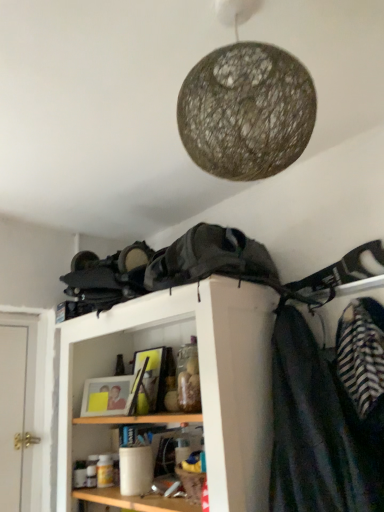
What do you see at coordinates (246, 105) in the screenshot?
I see `woven natural fiber lampshade at upper center` at bounding box center [246, 105].

This screenshot has height=512, width=384. Describe the element at coordinates (319, 430) in the screenshot. I see `striped fabric at right` at that location.

Locate an element on the screen. This screenshot has width=384, height=512. wooden shelf at center is located at coordinates (200, 379).

The height and width of the screenshot is (512, 384). In order to click on lamp above the striped fabric at right (from a real-world perspective) in this screenshot , I will do (246, 105).

Does striped fabric at right appear on the left side of woven natural fiber lampshade at upper center?

In fact, striped fabric at right is to the right of woven natural fiber lampshade at upper center.

Is striped fabric at right positioned behind woven natural fiber lampshade at upper center?

Yes, striped fabric at right is behind woven natural fiber lampshade at upper center.

Could you tell me if striped fabric at right is turned towards woven natural fiber lampshade at upper center?

Yes, striped fabric at right faces towards woven natural fiber lampshade at upper center.

What's the angular difference between wooden shelf at center and striped fabric at right's facing directions?

The facing directions of wooden shelf at center and striped fabric at right are 3.4e-05 degrees apart.

Find the location of a particular element. shelf below the striped fabric at right (from a real-world perspective) is located at coordinates (200, 379).

From the image's perspective, which is above, wooden shelf at center or striped fabric at right?

striped fabric at right.

Can you confirm if woven natural fiber lampshade at upper center is taller than striped fabric at right?

No.

Does woven natural fiber lampshade at upper center have a lesser width compared to striped fabric at right?

No, woven natural fiber lampshade at upper center is not thinner than striped fabric at right.

Considering the relative positions of woven natural fiber lampshade at upper center and striped fabric at right in the image provided, is woven natural fiber lampshade at upper center to the right of striped fabric at right from the viewer's perspective?

In fact, woven natural fiber lampshade at upper center is to the left of striped fabric at right.

From a real-world perspective, is woven natural fiber lampshade at upper center positioned under striped fabric at right based on gravity?

Incorrect, from a real-world perspective, woven natural fiber lampshade at upper center is higher than striped fabric at right.

Based on their positions, is wooden shelf at center located to the left or right of woven natural fiber lampshade at upper center?

Based on their positions, wooden shelf at center is located to the left of woven natural fiber lampshade at upper center.

From a real-world perspective, who is located lower, wooden shelf at center or woven natural fiber lampshade at upper center?

wooden shelf at center.

From the picture: Can you see wooden shelf at center touching woven natural fiber lampshade at upper center?

wooden shelf at center and woven natural fiber lampshade at upper center are clearly separated.

The width and height of the screenshot is (384, 512). I want to click on lamp lying in front of the wooden shelf at center, so click(x=246, y=105).

In the scene shown: From the image's perspective, is woven natural fiber lampshade at upper center on top of wooden shelf at center?

Indeed, from the image's perspective, woven natural fiber lampshade at upper center is shown above wooden shelf at center.

Is woven natural fiber lampshade at upper center bigger than wooden shelf at center?

Actually, woven natural fiber lampshade at upper center might be smaller than wooden shelf at center.

Is woven natural fiber lampshade at upper center inside the boundaries of wooden shelf at center, or outside?

woven natural fiber lampshade at upper center cannot be found inside wooden shelf at center.

Can you confirm if striped fabric at right is smaller than wooden shelf at center?

Yes.

From the image's perspective, is striped fabric at right above wooden shelf at center?

Yes, from the image's perspective, striped fabric at right is over wooden shelf at center.

Find the location of a particular element. Image resolution: width=384 pixels, height=512 pixels. shelf on the left of striped fabric at right is located at coordinates (200, 379).

Is point (305, 374) closer or farther from the camera than point (193, 298)?

Point (305, 374).

You are a GUI agent. You are given a task and a screenshot of the screen. Output one action in this format:
    pyautogui.click(x=<x>, y=<y>)
    Task: Click on the clothing that appears behind the woven natural fiber lampshade at upper center
    Image resolution: width=384 pixels, height=512 pixels.
    Given the screenshot: What is the action you would take?
    pyautogui.click(x=319, y=430)

Locate an element on the screen. The image size is (384, 512). shelf lying on the left of striped fabric at right is located at coordinates (200, 379).

From the image, which object appears to be nearer to wooden shelf at center, striped fabric at right or woven natural fiber lampshade at upper center?

Among the two, striped fabric at right is located nearer to wooden shelf at center.

From the image, which object appears to be farther from wooden shelf at center, woven natural fiber lampshade at upper center or striped fabric at right?

The object further to wooden shelf at center is woven natural fiber lampshade at upper center.

Considering their positions, is wooden shelf at center positioned further to woven natural fiber lampshade at upper center than striped fabric at right?

wooden shelf at center is positioned further to the anchor woven natural fiber lampshade at upper center.

Estimate the real-world distances between objects in this image. Which object is further from woven natural fiber lampshade at upper center, striped fabric at right or wooden shelf at center?

The object further to woven natural fiber lampshade at upper center is wooden shelf at center.

Which object lies nearer to the anchor point striped fabric at right, woven natural fiber lampshade at upper center or wooden shelf at center?

The object closer to striped fabric at right is wooden shelf at center.

Looking at the image, which one is located further to striped fabric at right, wooden shelf at center or woven natural fiber lampshade at upper center?

Based on the image, woven natural fiber lampshade at upper center appears to be further to striped fabric at right.

Image resolution: width=384 pixels, height=512 pixels. I want to click on clothing between woven natural fiber lampshade at upper center and wooden shelf at center from top to bottom, so (319, 430).